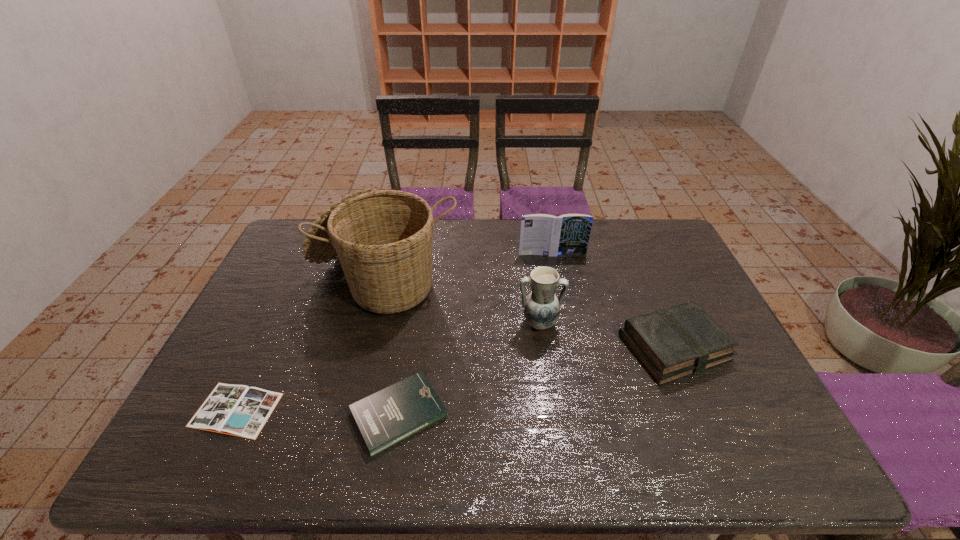
The image size is (960, 540). Find the location of `vacant area that lies between the pottery and the shortest book`. vacant area that lies between the pottery and the shortest book is located at coordinates (388, 367).

Identify the location of vacant space that's between the third tallest book and the leftmost book. Image resolution: width=960 pixels, height=540 pixels. (318, 412).

Identify the location of vacant space that's between the pottery and the second shortest book. This screenshot has width=960, height=540. (469, 369).

Where is `free area in between the second tallest book and the pottery`? The width and height of the screenshot is (960, 540). free area in between the second tallest book and the pottery is located at coordinates (607, 335).

You are a GUI agent. You are given a task and a screenshot of the screen. Output one action in this format:
    pyautogui.click(x=<x>, y=<y>)
    Task: Click on the free spot between the pottery and the second book from left to right
    The height and width of the screenshot is (540, 960).
    Given the screenshot: What is the action you would take?
    pyautogui.click(x=469, y=369)

Where is `vacant area that lies between the tallest book and the basket`? vacant area that lies between the tallest book and the basket is located at coordinates (469, 266).

The image size is (960, 540). I want to click on free space between the pottery and the third book from right to left, so click(469, 369).

Where is `object that is the third closest to the third shortest book`? The image size is (960, 540). object that is the third closest to the third shortest book is located at coordinates (383, 238).

Identify which object is located as the fifth nearest to the pottery. Please provide its 2D coordinates. Your answer should be formatted as a tuple, i.e. [(x, y)], where the tuple contains the x and y coordinates of a point satisfying the conditions above.

[(238, 410)]

Where is `book that is the second closest to the tallest object`? book that is the second closest to the tallest object is located at coordinates (541, 234).